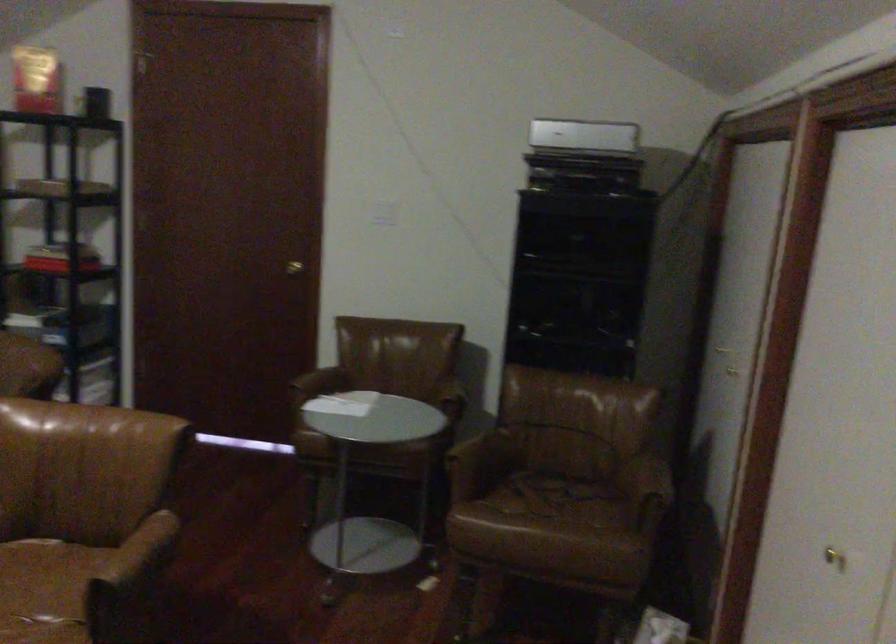
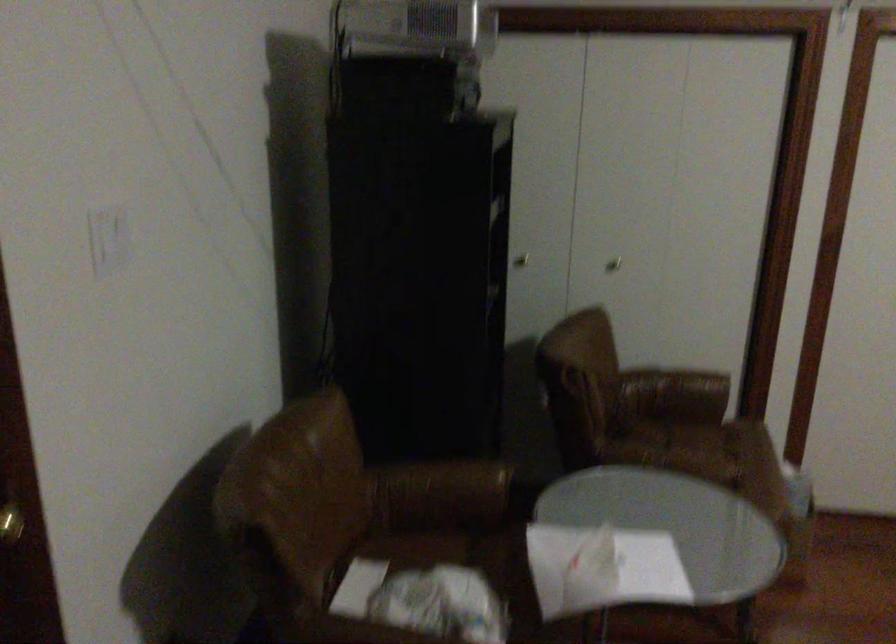
In the second image, find the point that corresponds to (x=540, y=136) in the first image.

(412, 26)